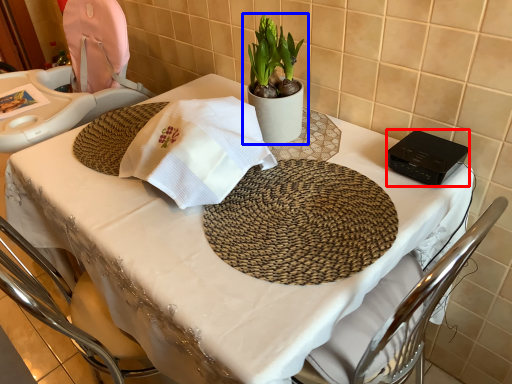
Question: Which of the following is the closest to the observer, gadget (highlighted by a red box) or houseplant (highlighted by a blue box)?

Choices:
 (A) gadget
 (B) houseplant

Answer: (A)